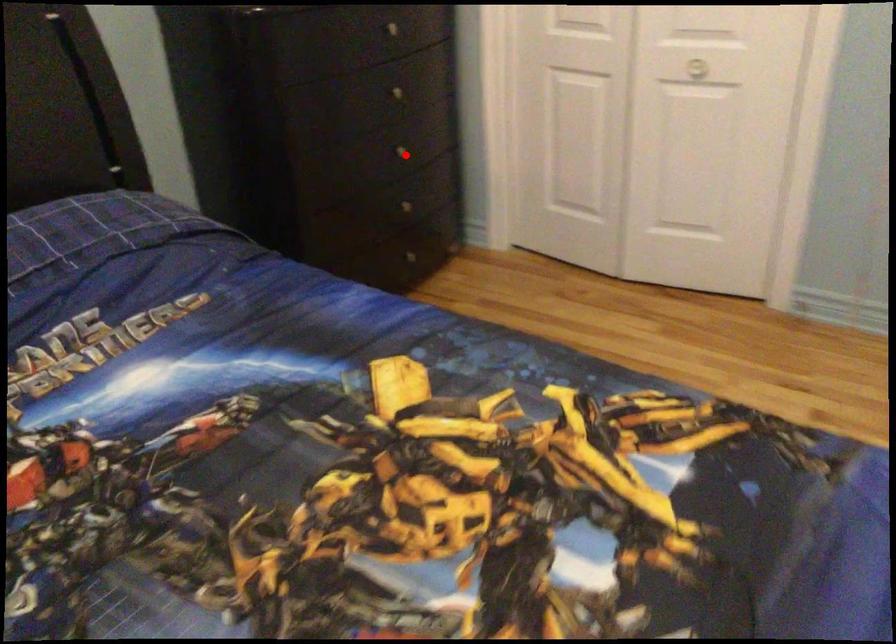
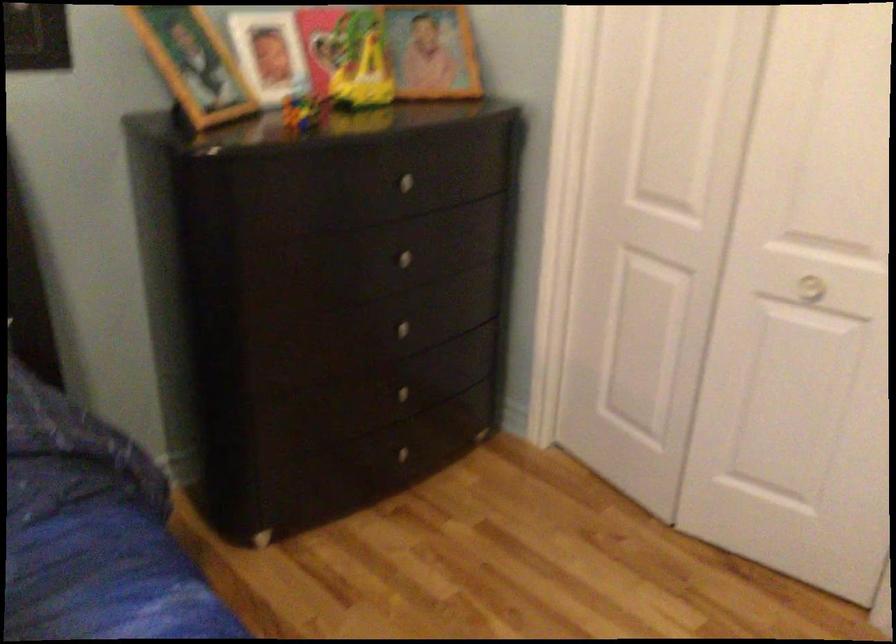
Question: I am providing you with two images of the same scene from different viewpoints. A red point is shown in image1. For the corresponding object point in image2, is it positioned nearer or farther from the camera?

Choices:
 (A) Nearer
 (B) Farther

Answer: (A)